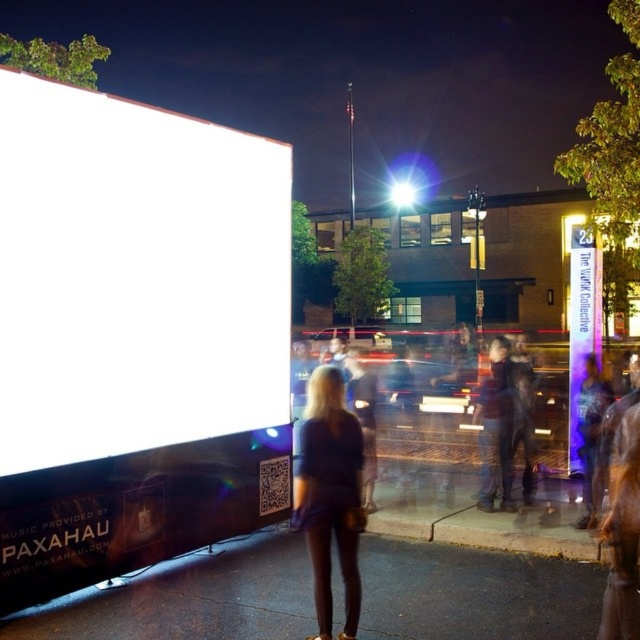
You are planning to take a photo of the white glossy screen at upper left and the translucent purple sign at center. Which object should you focus on first if you want to capture both in a single frame without moving the camera?

You should focus on the white glossy screen at upper left first because it occupies less space than the translucent purple sign at center, so it will fit into the frame more easily while still capturing the larger sign.

You are a photographer standing in the scene. You want to take a photo of the dark blue fabric dress at center without the white glossy screen at upper left appearing in the background. Is this possible?

The white glossy screen at upper left is located above the dark blue fabric dress at center, so if you position yourself below the dress, the screen might still be visible. Alternatively, moving to the side could help frame the dress without the screen, but the description does not provide enough spatial details to confirm.

Looking at this image, you are standing in the middle of the scene and want to take a photo of both the point at coordinates (28, 115) and the point at coordinates (326, 604). Which point is closer to you so that you can focus on it first?

Point (28, 115) is closer to you than point (326, 604), so you should focus on it first.